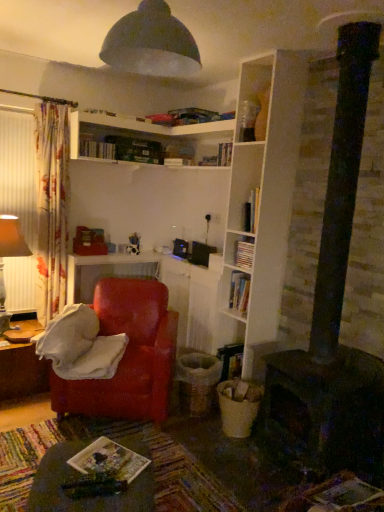
You are a GUI agent. You are given a task and a screenshot of the screen. Output one action in this format:
    pyautogui.click(x=<x>, y=<y>)
    Task: Click on the empty space that is ontop of wooden tray at lower center, marked as the 2th table in a left-to-right arrangement
    
    Given the screenshot: What is the action you would take?
    pyautogui.click(x=96, y=472)